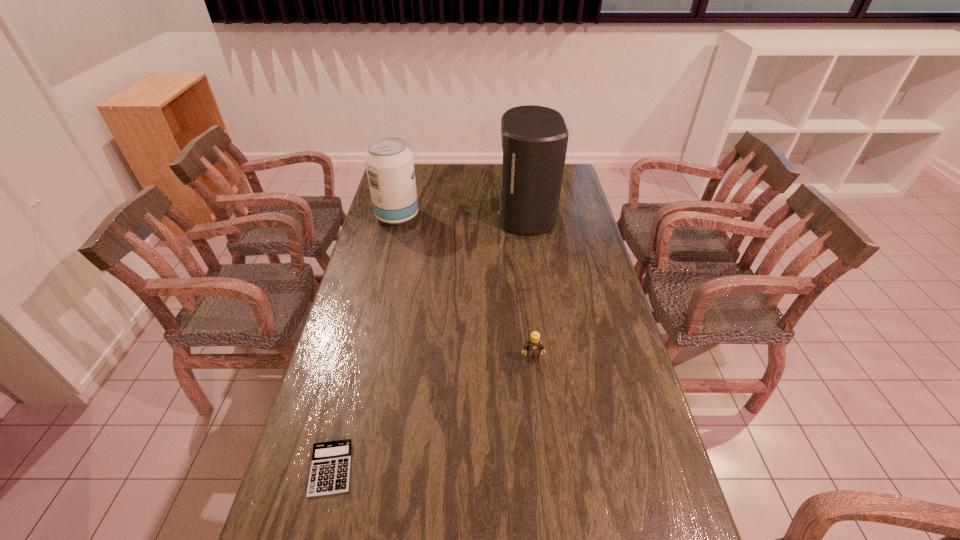
This screenshot has height=540, width=960. I want to click on coffee maker, so click(534, 139).

Find the location of `alcohol`. alcohol is located at coordinates [x=389, y=163].

This screenshot has width=960, height=540. Find the location of `the third tallest object`. the third tallest object is located at coordinates (534, 346).

Locate an element on the screen. The width and height of the screenshot is (960, 540). the third farthest object is located at coordinates (534, 346).

At what (x,y) coordinates should I click in order to perform the action: click on the nearest object. Please return your answer as a coordinate pair (x, y). This screenshot has width=960, height=540. Looking at the image, I should click on (330, 469).

Where is `calculator`? calculator is located at coordinates (330, 469).

In order to click on vacant space located on the button side of the coffee maker in this screenshot , I will do `click(412, 214)`.

At what (x,y) coordinates should I click in order to perform the action: click on free region located 0.330m on the button side of the coffee maker. Please return your answer as a coordinate pair (x, y). The image size is (960, 540). Looking at the image, I should click on (421, 214).

Identify the location of vacant space located on the button side of the coffee maker. (446, 214).

The width and height of the screenshot is (960, 540). I want to click on free space located 0.300m on the right of the alcohol, so click(489, 216).